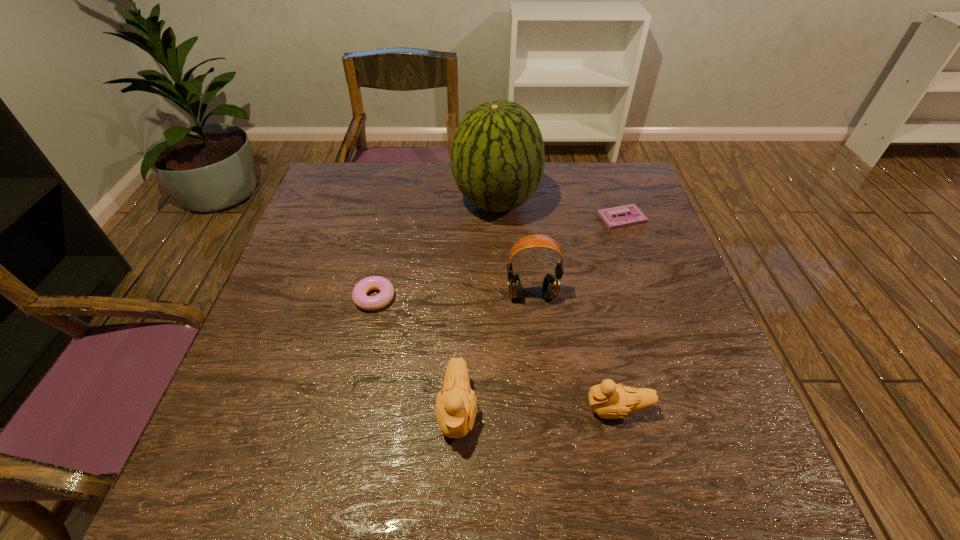
The image size is (960, 540). Find the location of `the fourth shortest object`. the fourth shortest object is located at coordinates (455, 409).

This screenshot has height=540, width=960. Identify the location of the taller duckling. click(x=455, y=409).

This screenshot has height=540, width=960. Find the location of `the shorter duckling`. the shorter duckling is located at coordinates (609, 400).

What are the coordinates of `the second object from right to left` in the screenshot? It's located at (609, 400).

This screenshot has height=540, width=960. In order to click on watermelon in this screenshot , I will do [497, 155].

Where is `the rightmost object`? Image resolution: width=960 pixels, height=540 pixels. the rightmost object is located at coordinates (634, 216).

Locate an element on the screen. The height and width of the screenshot is (540, 960). videotape is located at coordinates (634, 216).

Where is `doughnut`? doughnut is located at coordinates (386, 289).

Find the location of `the leftmost object`. the leftmost object is located at coordinates (386, 289).

Where is `headset`? headset is located at coordinates (551, 284).